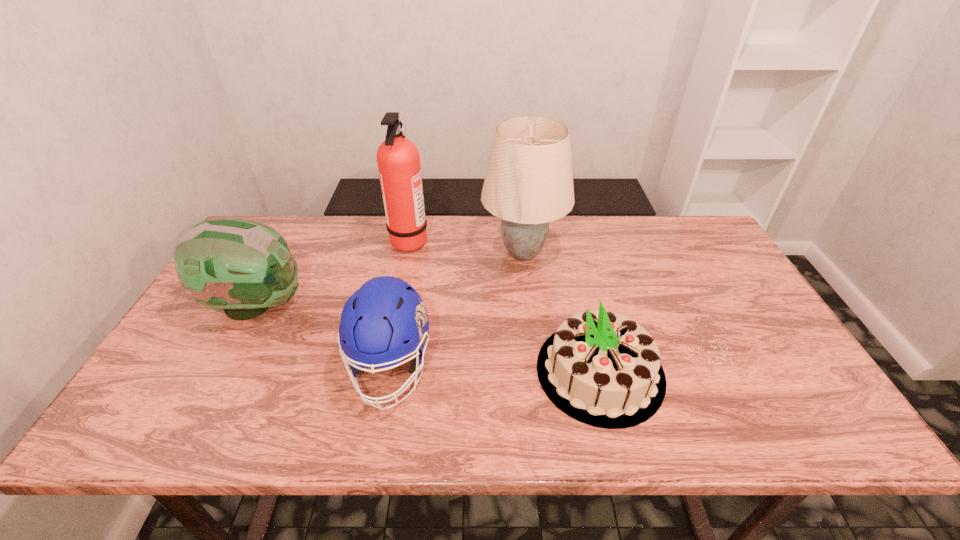
Find the location of a particular element. This screenshot has width=960, height=540. vacant point that satisfies the following two spatial constraints: 1. on the handle side of the birthday cake; 2. on the left side of the fire extinguisher is located at coordinates (383, 372).

The image size is (960, 540). I want to click on vacant region that satisfies the following two spatial constraints: 1. on the visor of the left football helmet; 2. on the left side of the birthday cake, so click(x=221, y=372).

The width and height of the screenshot is (960, 540). In order to click on vacant area that satisfies the following two spatial constraints: 1. on the handle side of the fire extinguisher; 2. on the right side of the shortest object in this screenshot , I will do `click(383, 372)`.